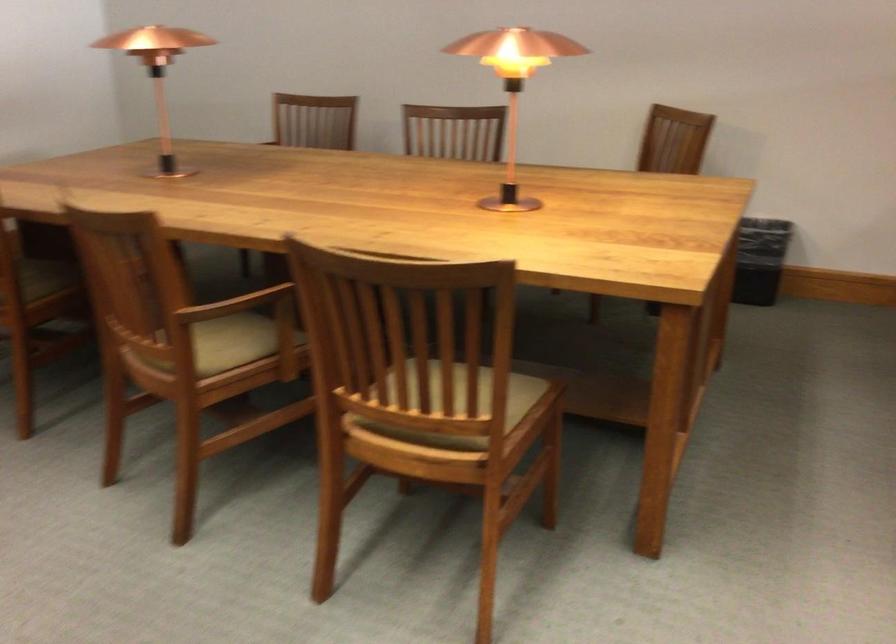
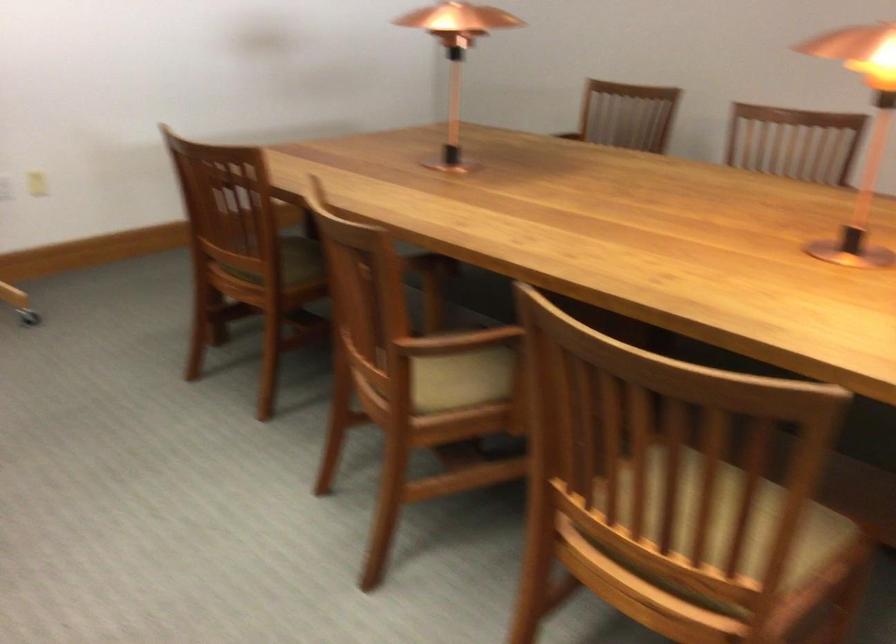
Where in the second image is the point corresponding to (229,343) from the first image?

(460, 377)